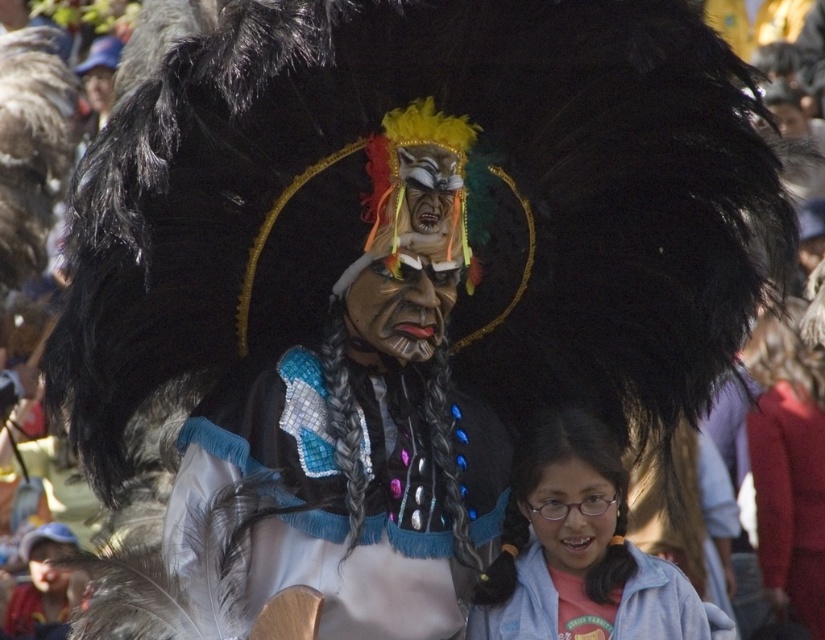
You are an artist trying to sketch the scene. You notice the shiny silver feathers at center. Where exactly are they positioned in the image?

The shiny silver feathers at center are located at point 0.783 on the horizontal axis and 0.396 on the vertical axis.

You are an observer at the festival and notice two pink fabric pieces in the image. Which one is positioned higher from the ground? The pink fabric at lower right or the pink fabric at lower center?

The pink fabric at lower right is located above the pink fabric at lower center, so it is positioned higher from the ground.